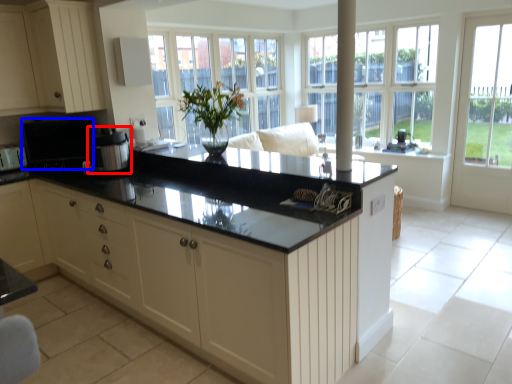
Question: Which of the following is the closest to the observer, appliance (highlighted by a red box) or appliance (highlighted by a blue box)?

Choices:
 (A) appliance
 (B) appliance

Answer: (A)